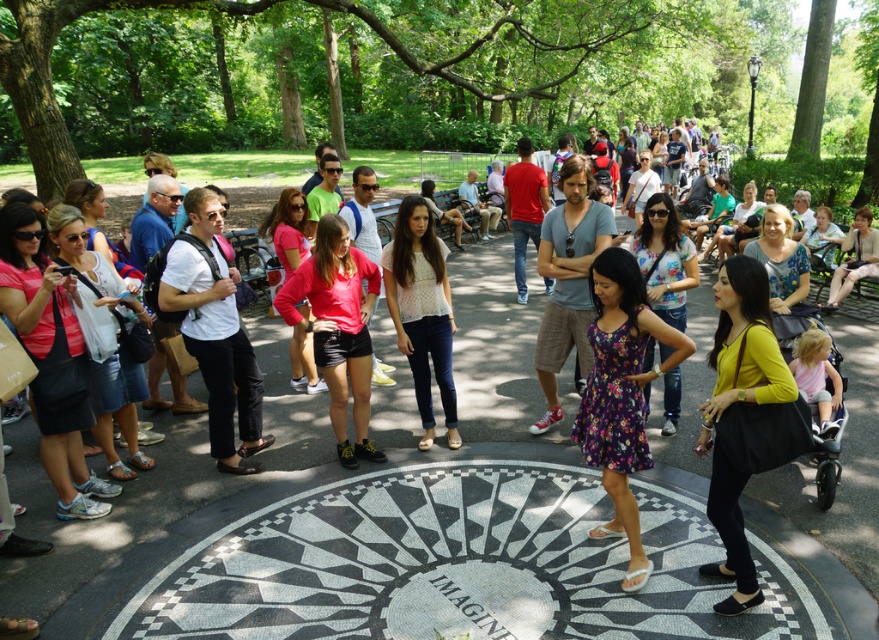
You are a photographer wanting to capture both the matte yellow blouse at center and the white lace top at center in the same frame. Which clothing item should you focus on first to ensure both are in the shot?

The matte yellow blouse at center is not as tall as white lace top at center, so you should focus on the taller white lace top at center first to ensure both are in the shot.